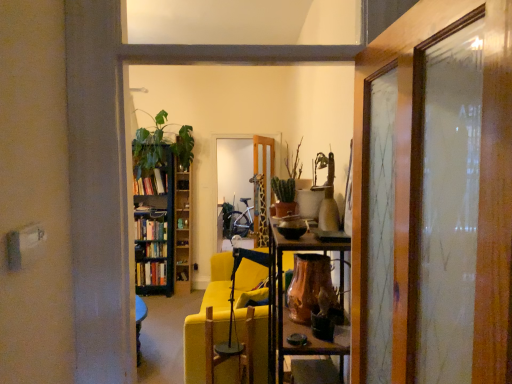
Question: Is hardcover books at left, which ranks as the 1th book in bottom-to-top order, positioned far away from hardcover books at left, which appears as the first book when viewed from the top?

Choices:
 (A) no
 (B) yes

Answer: (A)

Question: Does hardcover books at left, which ranks as the 1th book in bottom-to-top order, appear on the right side of hardcover books at left, the 2th book ordered from the bottom?

Choices:
 (A) yes
 (B) no

Answer: (B)

Question: From a real-world perspective, does hardcover books at left, which ranks as the 1th book in bottom-to-top order, sit lower than hardcover books at left, which appears as the first book when viewed from the top?

Choices:
 (A) no
 (B) yes

Answer: (B)

Question: Could hardcover books at left, the 2th book ordered from the bottom, be considered to be inside hardcover books at left, which is the 2th book from top to bottom?

Choices:
 (A) no
 (B) yes

Answer: (A)

Question: Does hardcover books at left, which is the 2th book from top to bottom, have a larger size compared to hardcover books at left, which appears as the first book when viewed from the top?

Choices:
 (A) yes
 (B) no

Answer: (B)

Question: Is hardcover books at left, which is the 2th book from top to bottom, positioned behind hardcover books at left, the 2th book ordered from the bottom?

Choices:
 (A) yes
 (B) no

Answer: (A)

Question: Is green matte cactus at center, which is counted as the third houseplant, starting from the back, further to camera compared to copper metallic vase at center?

Choices:
 (A) no
 (B) yes

Answer: (B)

Question: Is green matte cactus at center, which appears as the 2th houseplant when viewed from the left, at the right side of copper metallic vase at center?

Choices:
 (A) no
 (B) yes

Answer: (A)

Question: Is copper metallic vase at center a part of green matte cactus at center, which is counted as the third houseplant, starting from the back?

Choices:
 (A) yes
 (B) no

Answer: (B)

Question: Is green matte cactus at center, which is counted as the third houseplant, starting from the back, in contact with copper metallic vase at center?

Choices:
 (A) no
 (B) yes

Answer: (A)

Question: Is green matte cactus at center, which is the first houseplant in front-to-back order, aimed at copper metallic vase at center?

Choices:
 (A) no
 (B) yes

Answer: (A)

Question: Is green matte cactus at center, the second houseplant viewed from the right, taller than copper metallic vase at center?

Choices:
 (A) yes
 (B) no

Answer: (B)

Question: From a real-world perspective, is green matte cactus at center, the second houseplant viewed from the right, below wooden bookshelf at left?

Choices:
 (A) yes
 (B) no

Answer: (B)